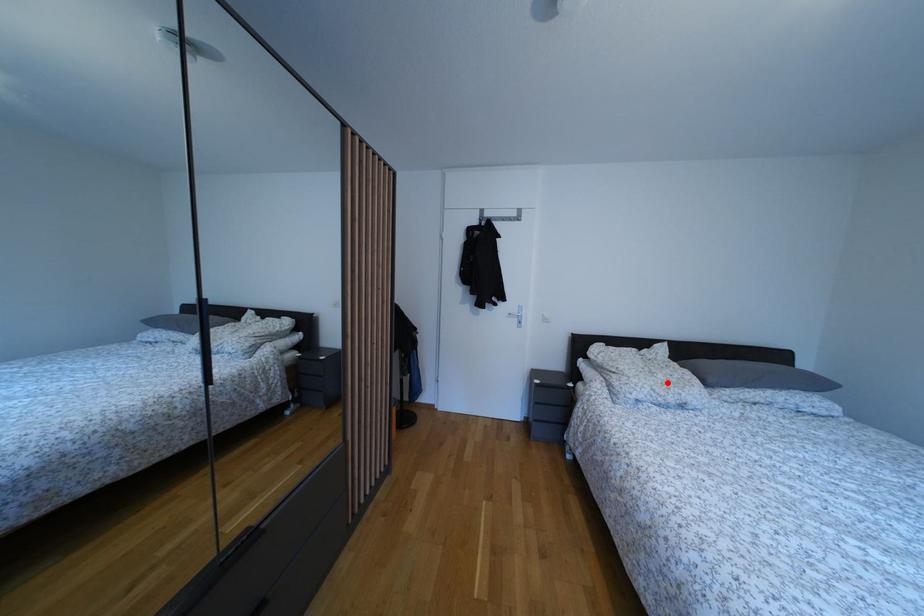
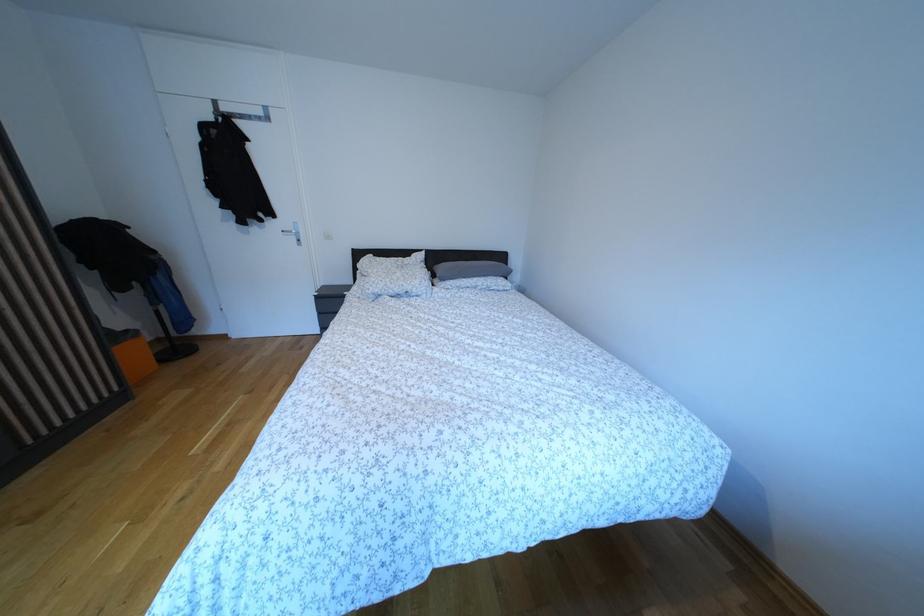
Locate, in the second image, the point that corresponds to the highlighted location in the first image.

(406, 281)